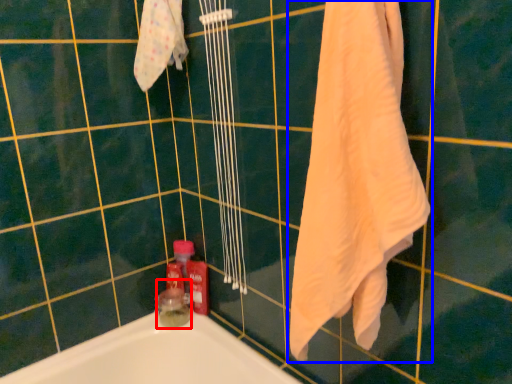
Question: Which of the following is the farthest to the observer, toiletry (highlighted by a red box) or towel (highlighted by a blue box)?

Choices:
 (A) toiletry
 (B) towel

Answer: (A)